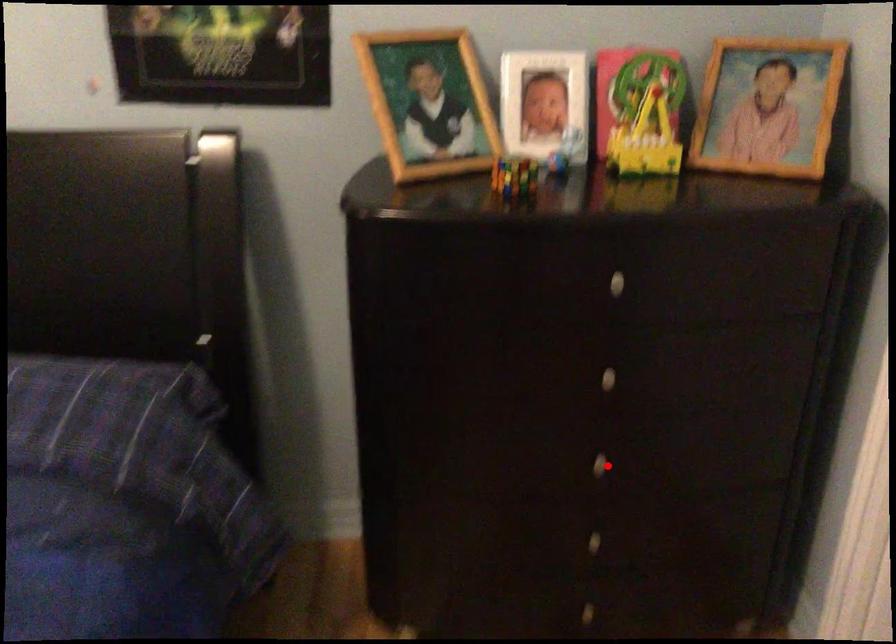
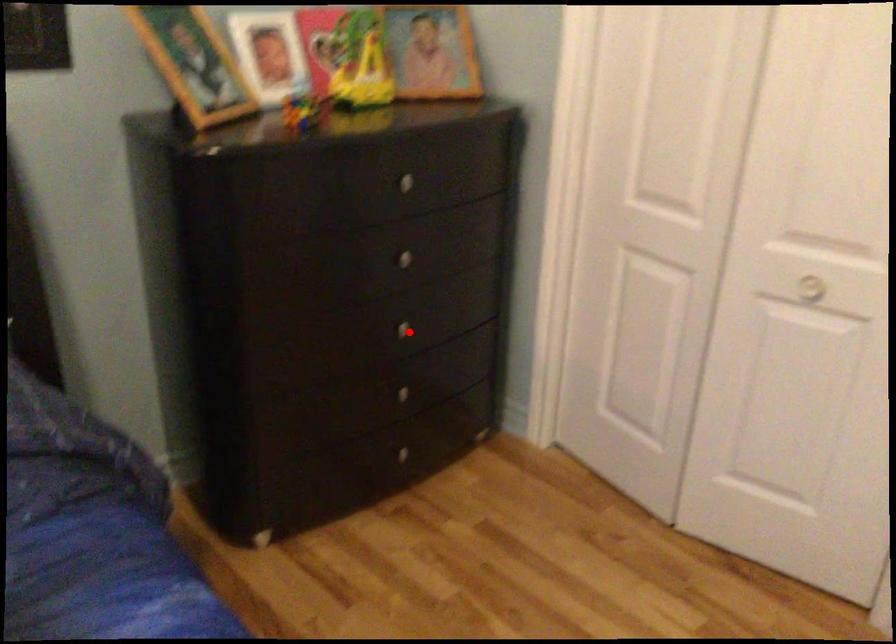
In the scene shown: I am providing you with two images of the same scene from different viewpoints. A red point is marked on the first image and another point is marked on the second image. Are the points marked in image1 and image2 representing the same 3D position?

Yes